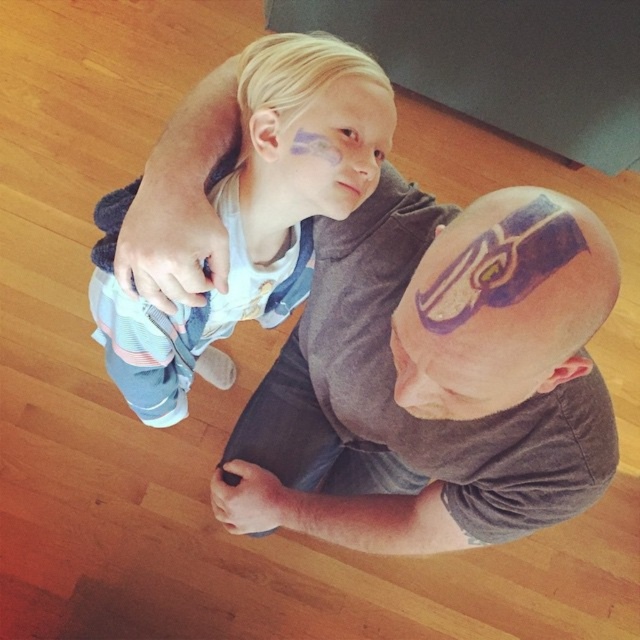
Is blonde hair at upper center to the right of matte blue paint at upper center from the viewer's perspective?

In fact, blonde hair at upper center is to the left of matte blue paint at upper center.

Find the location of a particular element. This screenshot has height=640, width=640. blonde hair at upper center is located at coordinates (252, 216).

Between purple matte bald head at center and blonde hair at upper center, which one has more height?

blonde hair at upper center

From the picture: Does purple matte bald head at center appear under blonde hair at upper center?

Indeed, purple matte bald head at center is positioned under blonde hair at upper center.

Is point (392, 440) closer to camera compared to point (275, 216)?

No, it is not.

Identify the location of purple matte bald head at center. (454, 371).

Which is more to the left, purple matte helmet at center or matte blue paint at upper center?

From the viewer's perspective, matte blue paint at upper center appears more on the left side.

Is purple matte helmet at center wider than matte blue paint at upper center?

Yes, purple matte helmet at center is wider than matte blue paint at upper center.

Who is more distant from viewer, (428,301) or (288,182)?

Point (288,182)

What are the coordinates of `purple matte helmet at center` in the screenshot? It's located at (500, 305).